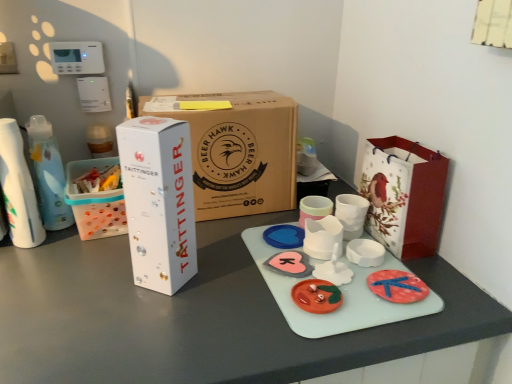
Find the location of a particular element. The height and width of the screenshot is (384, 512). vacant space that is to the left of matte plastic toy at center, the 4th toy from the back is located at coordinates (233, 297).